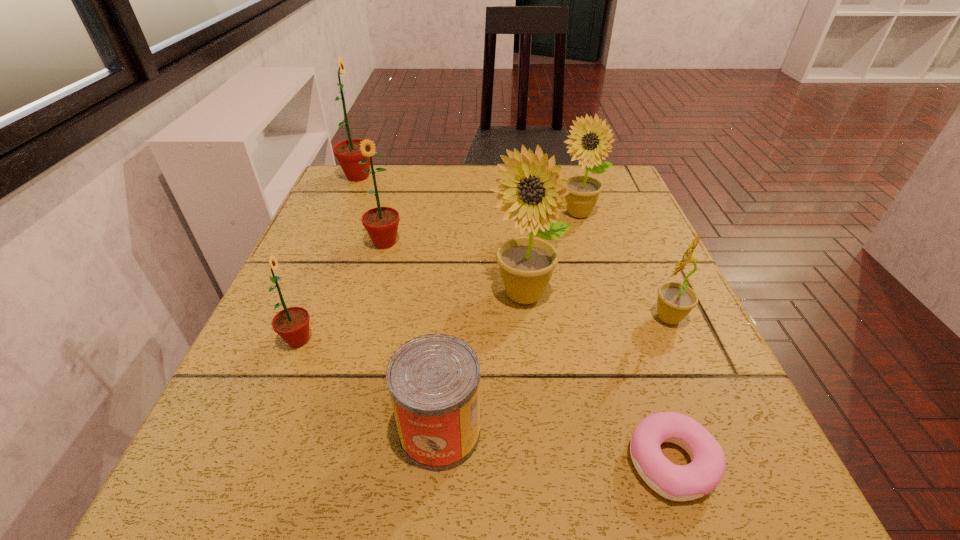
Locate an element on the screen. sunflower identified as the closest to the fourth object from left to right is located at coordinates (526, 264).

Locate which green sunflower ranks second in proximity to the farthest green sunflower. Please provide its 2D coordinates. Your answer should be formatted as a tuple, i.e. [(x, y)], where the tuple contains the x and y coordinates of a point satisfying the conditions above.

[(292, 324)]

Locate which green sunflower ranks second in proximity to the farthest green sunflower. Please provide its 2D coordinates. Your answer should be formatted as a tuple, i.e. [(x, y)], where the tuple contains the x and y coordinates of a point satisfying the conditions above.

[(292, 324)]

Locate which yellow sunflower is the second closest to the fifth nearest sunflower. Please provide its 2D coordinates. Your answer should be formatted as a tuple, i.e. [(x, y)], where the tuple contains the x and y coordinates of a point satisfying the conditions above.

[(675, 301)]

Choose which yellow sunflower is the second nearest neighbor to the fifth sunflower from left to right. Please provide its 2D coordinates. Your answer should be formatted as a tuple, i.e. [(x, y)], where the tuple contains the x and y coordinates of a point satisfying the conditions above.

[(675, 301)]

You are a GUI agent. You are given a task and a screenshot of the screen. Output one action in this format:
    pyautogui.click(x=<x>, y=<y>)
    Task: Click on the vacant region that satisfies the following two spatial constraints: 1. on the face of the shortest object; 2. on the right side of the fourth sunflower from right to left
    
    Given the screenshot: What is the action you would take?
    pyautogui.click(x=325, y=462)

Identify the location of free spot that satisfies the following two spatial constraints: 1. on the face of the can; 2. on the left side of the rightmost green sunflower. This screenshot has height=540, width=960. (333, 432).

Where is `free space in the image that satisfies the following two spatial constraints: 1. on the face of the third sunflower from right to left; 2. on the right side of the pastry`? free space in the image that satisfies the following two spatial constraints: 1. on the face of the third sunflower from right to left; 2. on the right side of the pastry is located at coordinates (540, 462).

I want to click on vacant space that satisfies the following two spatial constraints: 1. on the face of the pink pastry; 2. on the right side of the fourth sunflower from left to right, so click(x=540, y=462).